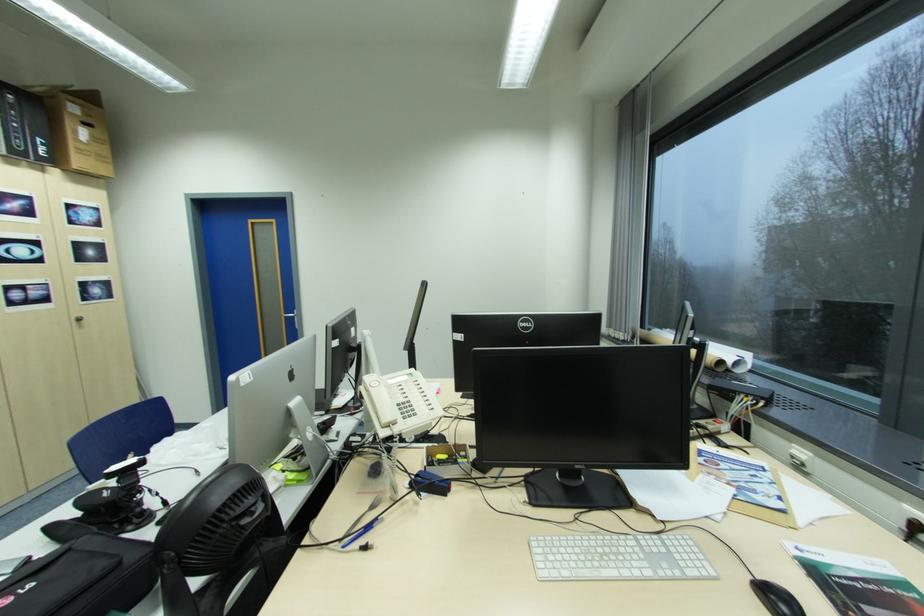
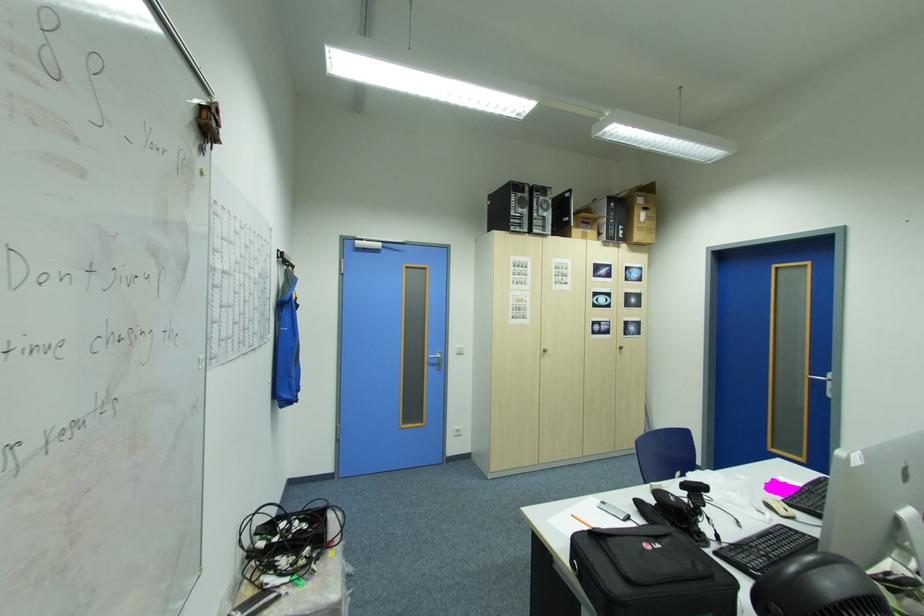
Question: The camera is either moving clockwise (left) or counter-clockwise (right) around the object. The first image is from the beginning of the video and the second image is from the end. Is the camera moving left or right when shooting the video?

Choices:
 (A) Left
 (B) Right

Answer: (B)